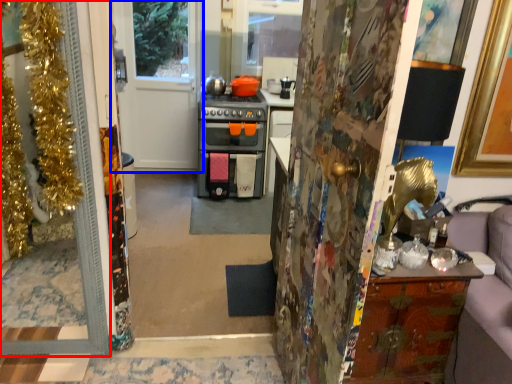
Question: Which point is further to the camera, door (highlighted by a red box) or door (highlighted by a blue box)?

Choices:
 (A) door
 (B) door

Answer: (B)